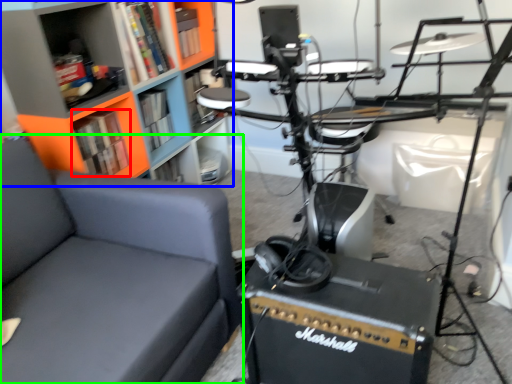
Question: Considering the real-world distances, which object is farthest from book (highlighted by a red box)? bookcase (highlighted by a blue box) or chair (highlighted by a green box)?

Choices:
 (A) bookcase
 (B) chair

Answer: (B)